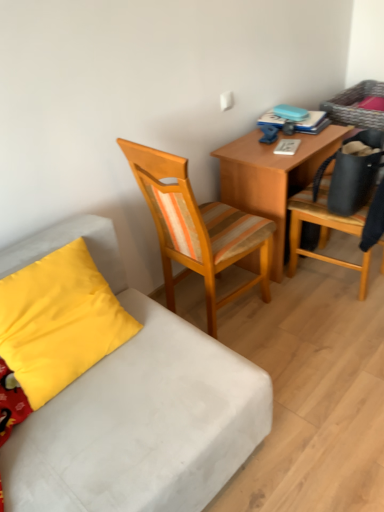
The width and height of the screenshot is (384, 512). In order to click on vacant area located to the right-hand side of woodenchair at center, positioned as the second chair in right-to-left order in this screenshot , I will do `click(312, 322)`.